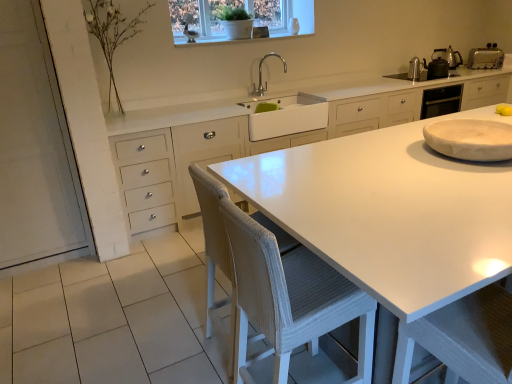
Measure the distance between point (444, 48) and camera.

16.65 feet.

Image resolution: width=512 pixels, height=384 pixels. In order to click on yellow matte lemon at upper right in this screenshot , I will do `click(504, 109)`.

What do you see at coordinates (247, 11) in the screenshot? I see `white glossy window at upper center` at bounding box center [247, 11].

Describe the element at coordinates (388, 213) in the screenshot. This screenshot has width=512, height=384. I see `white glossy countertop at center` at that location.

In order to click on metallic silver kettle at upper right, which is the 4th appliance from bottom to top in this screenshot , I will do `click(449, 56)`.

Consider the image. From a real-world perspective, which object rests below the other?

white woven chair at center.

Is white woven chair at center in contact with metallic silver kettle at upper right, placed as the 2th appliance when sorted from front to back?

No, white woven chair at center is not next to metallic silver kettle at upper right, placed as the 2th appliance when sorted from front to back.

Who is taller, white woven chair at center or metallic silver kettle at upper right, the 2th appliance from the bottom?

With more height is white woven chair at center.

Which is more to the left, yellow matte lemon at upper right or silver metallic toaster at upper right, the third appliance when ordered from front to back?

yellow matte lemon at upper right.

Is point (509, 112) closer or farther from the camera than point (485, 54)?

Point (509, 112).

In the scene shown: Looking at their sizes, would you say yellow matte lemon at upper right is wider or thinner than silver metallic toaster at upper right, which is the second appliance from top to bottom?

Considering their sizes, yellow matte lemon at upper right looks slimmer than silver metallic toaster at upper right, which is the second appliance from top to bottom.

From the image's perspective, between white woven chair at center and silver metallic faucet at upper center, which one is located above?

silver metallic faucet at upper center, from the image's perspective.

Is white woven chair at center shorter than silver metallic faucet at upper center?

No, white woven chair at center is not shorter than silver metallic faucet at upper center.

Can you tell me how much white woven chair at center and silver metallic faucet at upper center differ in facing direction?

There is a 87.6-degree angle between the facing directions of white woven chair at center and silver metallic faucet at upper center.

Is white woven chair at center not near silver metallic faucet at upper center?

Yes, white woven chair at center and silver metallic faucet at upper center are quite far apart.

From the image's perspective, is silver metallic toaster at upper right, the 2th appliance when ordered from back to front, beneath metallic silver kettle at upper right, which ranks as the third appliance in top-to-bottom order?

Actually, silver metallic toaster at upper right, the 2th appliance when ordered from back to front, appears above metallic silver kettle at upper right, which ranks as the third appliance in top-to-bottom order, in the image.

Is silver metallic toaster at upper right, the third appliance positioned from the bottom, further to camera compared to metallic silver kettle at upper right, which is the 2th appliance from left to right?

Yes, the depth of silver metallic toaster at upper right, the third appliance positioned from the bottom, is greater than that of metallic silver kettle at upper right, which is the 2th appliance from left to right.

Is silver metallic toaster at upper right, which ranks as the first appliance in right-to-left order, aimed at metallic silver kettle at upper right, acting as the third appliance starting from the right?

No, silver metallic toaster at upper right, which ranks as the first appliance in right-to-left order, is not oriented towards metallic silver kettle at upper right, acting as the third appliance starting from the right.

In the scene shown: Considering the positions of objects silver metallic toaster at upper right, which is the second appliance from top to bottom, and metallic silver kettle at upper right, the 2th appliance from the bottom, in the image provided, who is more to the left, silver metallic toaster at upper right, which is the second appliance from top to bottom, or metallic silver kettle at upper right, the 2th appliance from the bottom,?

Positioned to the left is metallic silver kettle at upper right, the 2th appliance from the bottom.

Looking at this image, which is further, (x=275, y=11) or (x=509, y=111)?

The point (x=275, y=11) is farther.

Is white glossy window at upper center at the right side of yellow matte lemon at upper right?

No.

Which object is thinner, white glossy window at upper center or yellow matte lemon at upper right?

Thinner between the two is yellow matte lemon at upper right.

At what (x,y) coordinates should I click in order to perform the action: click on food that is in front of the white glossy window at upper center. Please return your answer as a coordinate pair (x, y). The width and height of the screenshot is (512, 384). Looking at the image, I should click on (504, 109).

From a real-world perspective, who is located lower, yellow matte lemon at upper right or white glossy window at upper center?

From a 3D spatial view, yellow matte lemon at upper right is below.

From the image's perspective, between yellow matte lemon at upper right and white glossy window at upper center, which one is located above?

From the image's view, white glossy window at upper center is above.

In the scene shown: Which of these two, yellow matte lemon at upper right or white glossy window at upper center, stands taller?

white glossy window at upper center.

Can you confirm if white glossy countertop at center is taller than silver metallic toaster at upper right, which ranks as the first appliance in right-to-left order?

Correct, white glossy countertop at center is much taller as silver metallic toaster at upper right, which ranks as the first appliance in right-to-left order.

Which of these two, white glossy countertop at center or silver metallic toaster at upper right, the 2th appliance when ordered from back to front, is bigger?

white glossy countertop at center.

Looking at this image, from a real-world perspective, is white glossy countertop at center located higher than silver metallic toaster at upper right, which is the second appliance from top to bottom?

No.

From the image's perspective, is white glossy countertop at center below silver metallic toaster at upper right, which is the second appliance from top to bottom?

Indeed, from the image's perspective, white glossy countertop at center is shown beneath silver metallic toaster at upper right, which is the second appliance from top to bottom.

This screenshot has height=384, width=512. Identify the location of chair in front of the metallic silver kettle at upper right, acting as the third appliance starting from the right. (280, 286).

Which appliance is the 2nd one when counting from the back of the yellow matte lemon at upper right? Please provide its 2D coordinates.

[(485, 57)]

From the image, which object appears to be nearer to silver metallic toaster at upper right, the third appliance when ordered from front to back, white woven chair at center or white glossy window at upper center?

white glossy window at upper center lies closer to silver metallic toaster at upper right, the third appliance when ordered from front to back, than the other object.

Looking at the image, which one is located closer to yellow matte lemon at upper right, metallic silver kettle at upper right, the 2th appliance from the bottom, or white woven chair at center?

metallic silver kettle at upper right, the 2th appliance from the bottom, is positioned closer to the anchor yellow matte lemon at upper right.

Based on the photo, which object lies nearer to the anchor point yellow matte lemon at upper right, white glossy countertop at center or white glossy window at upper center?

The object closer to yellow matte lemon at upper right is white glossy countertop at center.

When comparing their distances from white glossy window at upper center, does silver metallic toaster at upper right, the 2th appliance when ordered from back to front, or metallic silver kettle at upper right, which ranks as the third appliance in top-to-bottom order, seem closer?

metallic silver kettle at upper right, which ranks as the third appliance in top-to-bottom order, is closer to white glossy window at upper center.

When comparing their distances from white woven chair at center, does silver metallic toaster at upper right, the third appliance positioned from the bottom, or metallic silver kettle at upper right, which ranks as the third appliance in top-to-bottom order, seem closer?

Among the two, metallic silver kettle at upper right, which ranks as the third appliance in top-to-bottom order, is located nearer to white woven chair at center.

Estimate the real-world distances between objects in this image. Which object is further from metallic silver kettle at upper right, acting as the third appliance starting from the right, silver metallic toaster at upper right, which ranks as the first appliance in right-to-left order, or yellow matte lemon at upper right?

Based on the image, yellow matte lemon at upper right appears to be further to metallic silver kettle at upper right, acting as the third appliance starting from the right.

Which object lies further to the anchor point silver metallic faucet at upper center, silver metallic toaster at upper right, which ranks as the first appliance in right-to-left order, or white glossy countertop at center?

Based on the image, silver metallic toaster at upper right, which ranks as the first appliance in right-to-left order, appears to be further to silver metallic faucet at upper center.

Looking at the image, which one is located closer to metallic silver kettle at upper right, the 3th appliance in the back-to-front sequence, silver metallic faucet at upper center or white woven chair at center?

silver metallic faucet at upper center.

Identify the location of appliance positioned between white marble plate at right, acting as the 1th appliance starting from the bottom, and silver metallic toaster at upper right, the third appliance positioned from the bottom, from near to far. (414, 69).

What are the coordinates of `window between white woven chair at center and metallic silver kettle at upper right, which is the 4th appliance from bottom to top, in the front-back direction` in the screenshot? It's located at (247, 11).

At what (x,y) coordinates should I click in order to perform the action: click on food between white marble plate at right, the fourth appliance positioned from the back, and metallic silver kettle at upper right, which appears as the 1th appliance when viewed from the back, in the front-back direction. Please return your answer as a coordinate pair (x, y). Looking at the image, I should click on (504, 109).

What are the coordinates of `food between white woven chair at center and metallic silver kettle at upper right, which is the 4th appliance from bottom to top, from front to back` in the screenshot? It's located at (504, 109).